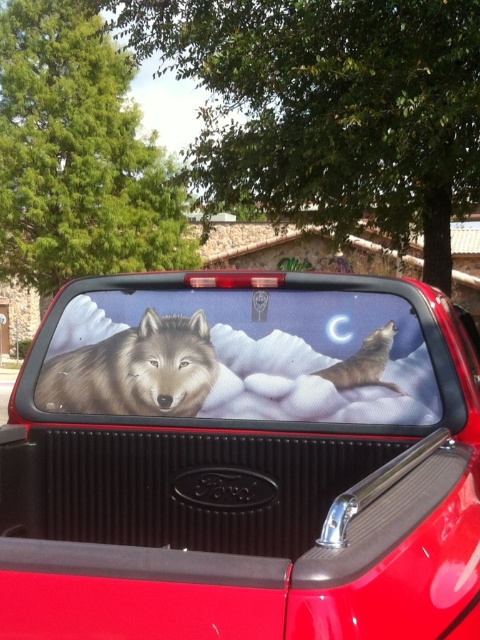
You are a delivery person standing 1.7 meters away from the matte plastic truck bed at center. Can you safely load a package onto the truck bed without needing to move closer?

The distance between the matte plastic truck bed at center and the camera is 1.72 meters. Since you are standing 1.7 meters away, you are slightly closer than the measured distance, so you can safely load the package without needing to move closer.

You are a delivery person who needs to place a package on the matte plastic truck bed at center. The package is 10 cm tall. Can you determine if the gray matte wolf at center will block the placement of the package on the truck bed?

The matte plastic truck bed at center is taller than gray matte wolf at center, so the wolf will not block the placement of the package as it is shorter than the truck bed.